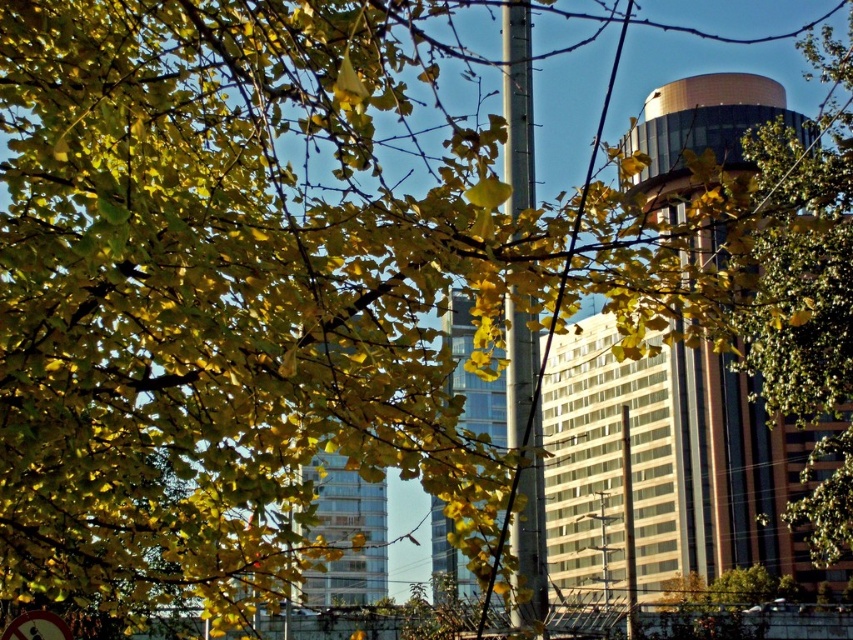
You are a drone operator trying to navigate between two points in the urban scene. The first point is at coordinate point (737, 113) and the second point is at coordinate point (444, 586). According to the image, which point is closer to the foreground?

Point (444, 586) is closer to the foreground because it is in front of point (737, 113).

You are an architect analyzing this urban scene. You notice the gold reflective tower at upper right and the red plastic circle at lower left. Based on their sizes, which object would cast a larger shadow during midday when the sun is directly overhead?

The gold reflective tower at upper right is bigger than the red plastic circle at lower left, so it would cast a larger shadow during midday when the sun is directly overhead.

You are standing in the urban scene and want to place a small red flag exactly where the red plastic circle at lower left is located. If you face the glassy reflective skyscraper at center, which direction should you turn to place the flag correctly?

You should turn to your left because the red plastic circle at lower left is to the left of the glassy reflective skyscraper at center.